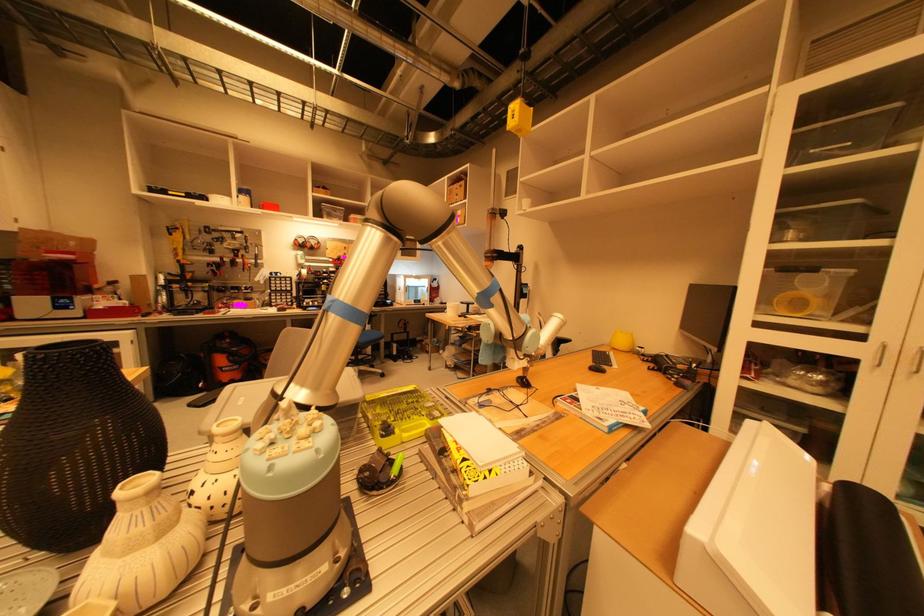
Where would you sit the grey chair sitting surface? Please return your answer as a coordinate pair (x, y).

(497, 353)